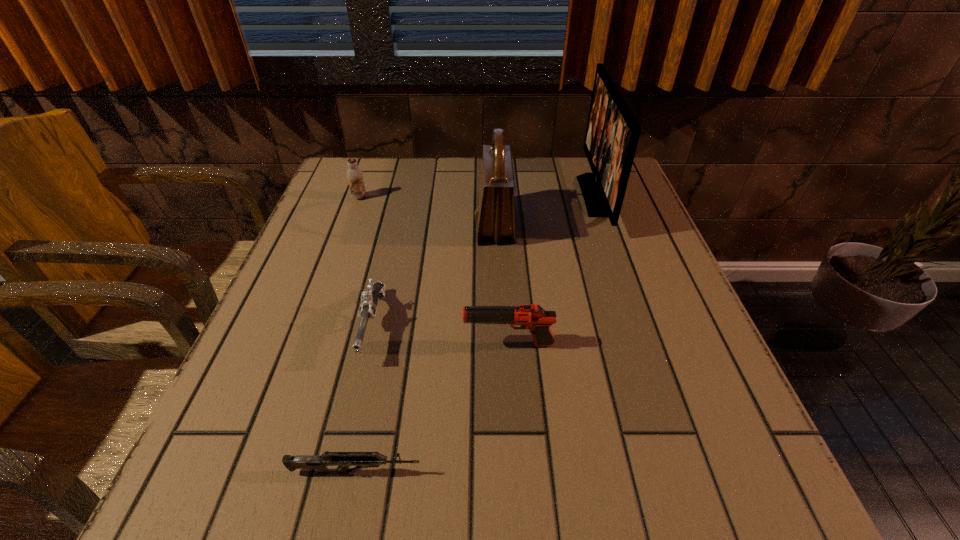
The image size is (960, 540). Identify the location of vacant space located 0.270m on the front flap of the second tallest object. (365, 224).

This screenshot has width=960, height=540. I want to click on free space located 0.330m on the front flap of the second tallest object, so click(x=341, y=224).

What are the coordinates of `vacant space situated 0.300m on the front flap of the second tallest object` in the screenshot? It's located at (353, 224).

Identify the location of vacant space located on the front of the chocolate milk. (343, 244).

Where is `free space located at the aiming end of the rightmost gun`? Image resolution: width=960 pixels, height=540 pixels. free space located at the aiming end of the rightmost gun is located at coordinates (431, 345).

The height and width of the screenshot is (540, 960). In order to click on free region located at the aiming end of the rightmost gun in this screenshot , I will do `click(284, 345)`.

Identify the location of vacant position located 0.250m at the aiming end of the rightmost gun. The image size is (960, 540). pos(328,345).

Find the location of a particular element. free space located 0.070m aimed along the barrel of the second tallest gun is located at coordinates (354, 403).

You are a GUI agent. You are given a task and a screenshot of the screen. Output one action in this format:
    pyautogui.click(x=<x>, y=<y>)
    Task: Click on the vacant space situated 0.170m aimed along the barrel of the shortest gun
    The image size is (960, 540).
    Given the screenshot: What is the action you would take?
    pyautogui.click(x=538, y=471)

Identify the location of monitor that is at the far edge. This screenshot has width=960, height=540. (612, 133).